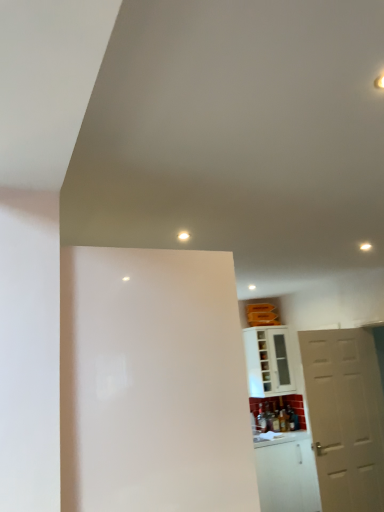
In order to click on white glossy cabinet at lower right in this screenshot , I will do `click(270, 361)`.

Where is `white matte door at right`? The width and height of the screenshot is (384, 512). white matte door at right is located at coordinates (x=345, y=417).

In order to face white glossy screen door at center, should I rotate leftwards or rightwards?

To align with it, rotate left about 7.329°.

Where is `white glossy screen door at center`? white glossy screen door at center is located at coordinates (152, 382).

Locate an element on the screen. white glossy cabinet at lower right is located at coordinates (270, 361).

Which point is more forward, (261, 369) or (174, 485)?

The point (174, 485) is more forward.

Considering the positions of objects white glossy cabinet at lower right and white glossy screen door at center in the image provided, who is behind, white glossy cabinet at lower right or white glossy screen door at center?

white glossy cabinet at lower right is further from the camera.

Who is smaller, white glossy cabinet at lower right or white glossy screen door at center?

Smaller between the two is white glossy cabinet at lower right.

Considering the positions of point (356, 414) and point (241, 371), is point (356, 414) closer or farther from the camera than point (241, 371)?

Point (356, 414) appears to be farther away from the viewer than point (241, 371).

Considering the relative sizes of white matte door at right and white glossy screen door at center in the image provided, is white matte door at right shorter than white glossy screen door at center?

No, white matte door at right is not shorter than white glossy screen door at center.

Who is smaller, white matte door at right or white glossy screen door at center?

With smaller size is white matte door at right.

Based on the photo, relative to white glossy screen door at center, is white matte door at right in front or behind?

white matte door at right is positioned farther from the viewer than white glossy screen door at center.

How many degrees apart are the facing directions of white matte door at right and white glossy cabinet at lower right?

They differ by 2.49 degrees in their facing directions.

Considering the relative positions of white matte door at right and white glossy cabinet at lower right in the image provided, is white matte door at right to the left of white glossy cabinet at lower right from the viewer's perspective?

No.

Does white matte door at right have a lesser width compared to white glossy cabinet at lower right?

Correct, the width of white matte door at right is less than that of white glossy cabinet at lower right.

Consider the image. Is white matte door at right turned away from white glossy cabinet at lower right?

Absolutely, white matte door at right is directed away from white glossy cabinet at lower right.

Could you tell me if white glossy screen door at center is turned towards white matte door at right?

No, white glossy screen door at center is not turned towards white matte door at right.

From the image's perspective, which one is positioned lower, white glossy screen door at center or white matte door at right?

white matte door at right appears lower in the image.

Does white glossy screen door at center come behind white matte door at right?

No, white glossy screen door at center is in front of white matte door at right.

Is point (66, 503) closer to camera compared to point (349, 415)?

That is True.

Are white glossy cabinet at lower right and white matte door at right far apart?

That's right, there is a large distance between white glossy cabinet at lower right and white matte door at right.

Does point (276, 326) come in front of point (312, 350)?

That is False.

Between white glossy cabinet at lower right and white matte door at right, which one appears on the left side from the viewer's perspective?

Positioned to the left is white glossy cabinet at lower right.

From the image's perspective, between white glossy cabinet at lower right and white matte door at right, which one is located above?

white glossy cabinet at lower right is shown above in the image.

From their relative heights in the image, would you say white glossy screen door at center is taller or shorter than white glossy cabinet at lower right?

Clearly, white glossy screen door at center is taller compared to white glossy cabinet at lower right.

Is point (103, 284) farther from viewer compared to point (260, 339)?

No, (103, 284) is closer to viewer.

Is white glossy screen door at center situated inside white glossy cabinet at lower right or outside?

white glossy screen door at center is outside white glossy cabinet at lower right.

This screenshot has height=512, width=384. Identify the location of cabinetry that appears above the white glossy screen door at center (from a real-world perspective). (270, 361).

What are the coordinates of `door located on the right of white glossy screen door at center` in the screenshot? It's located at (345, 417).

Which object lies further to the anchor point white glossy screen door at center, white glossy cabinet at lower right or white matte door at right?

white glossy cabinet at lower right.

Estimate the real-world distances between objects in this image. Which object is further from white glossy screen door at center, white matte door at right or white glossy cabinet at lower right?

Among the two, white glossy cabinet at lower right is located further to white glossy screen door at center.

Looking at the image, which one is located closer to white matte door at right, white glossy cabinet at lower right or white glossy screen door at center?

white glossy cabinet at lower right is positioned closer to the anchor white matte door at right.

When comparing their distances from white glossy cabinet at lower right, does white glossy screen door at center or white matte door at right seem closer?

white matte door at right is closer to white glossy cabinet at lower right.

When comparing their distances from white glossy cabinet at lower right, does white matte door at right or white glossy screen door at center seem closer?

white matte door at right.

Considering their positions, is white glossy screen door at center positioned closer to white matte door at right than white glossy cabinet at lower right?

Based on the image, white glossy cabinet at lower right appears to be nearer to white matte door at right.

At what (x,y) coordinates should I click in order to perform the action: click on door positioned between white glossy screen door at center and white glossy cabinet at lower right from near to far. Please return your answer as a coordinate pair (x, y). This screenshot has width=384, height=512. Looking at the image, I should click on (345, 417).